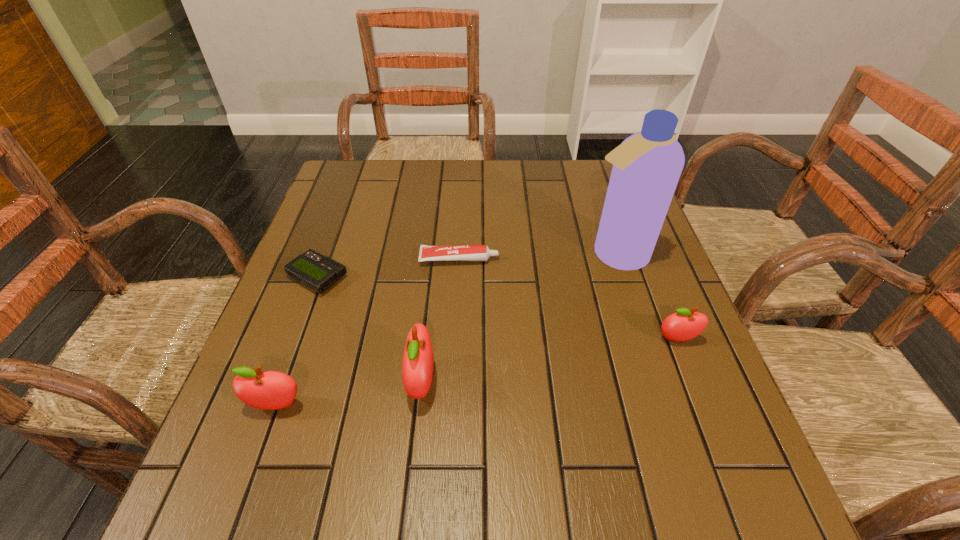
The height and width of the screenshot is (540, 960). What are the coordinates of `blank region between the tallest apple and the second tallest apple` in the screenshot? It's located at (349, 394).

Where is `free space between the rightmost apple and the tallest object`? Image resolution: width=960 pixels, height=540 pixels. free space between the rightmost apple and the tallest object is located at coordinates (646, 297).

Where is `vacant space that's between the rightmost apple and the tallest apple`? The image size is (960, 540). vacant space that's between the rightmost apple and the tallest apple is located at coordinates (549, 361).

Locate an element on the screen. free spot between the toothpaste and the fourth tallest object is located at coordinates (568, 299).

Locate an element on the screen. This screenshot has width=960, height=540. vacant area that lies between the second tallest apple and the toothpaste is located at coordinates (368, 332).

The width and height of the screenshot is (960, 540). I want to click on vacant space that is in between the beeper and the toothpaste, so click(x=389, y=268).

Where is `vacant area that lies between the beeper and the second shortest apple`? The width and height of the screenshot is (960, 540). vacant area that lies between the beeper and the second shortest apple is located at coordinates (298, 341).

At what (x,y) coordinates should I click in order to perform the action: click on the closest object to the toothpaste. Please return your answer as a coordinate pair (x, y). Image resolution: width=960 pixels, height=540 pixels. Looking at the image, I should click on (318, 272).

Where is `object identified as the second closest to the shampoo`? object identified as the second closest to the shampoo is located at coordinates (455, 252).

Locate which apple is the second closest to the leftmost apple. Please provide its 2D coordinates. Your answer should be formatted as a tuple, i.e. [(x, y)], where the tuple contains the x and y coordinates of a point satisfying the conditions above.

[(684, 325)]